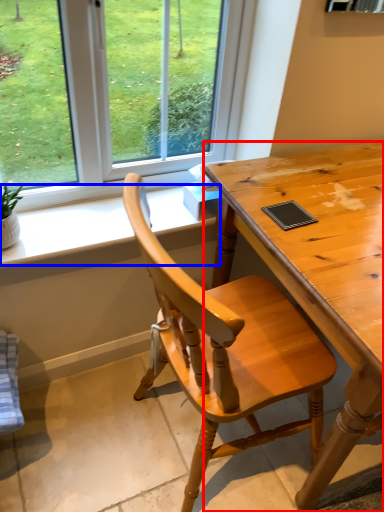
Question: Which object appears farthest to the camera in this image, desk (highlighted by a red box) or window sill (highlighted by a blue box)?

Choices:
 (A) desk
 (B) window sill

Answer: (B)